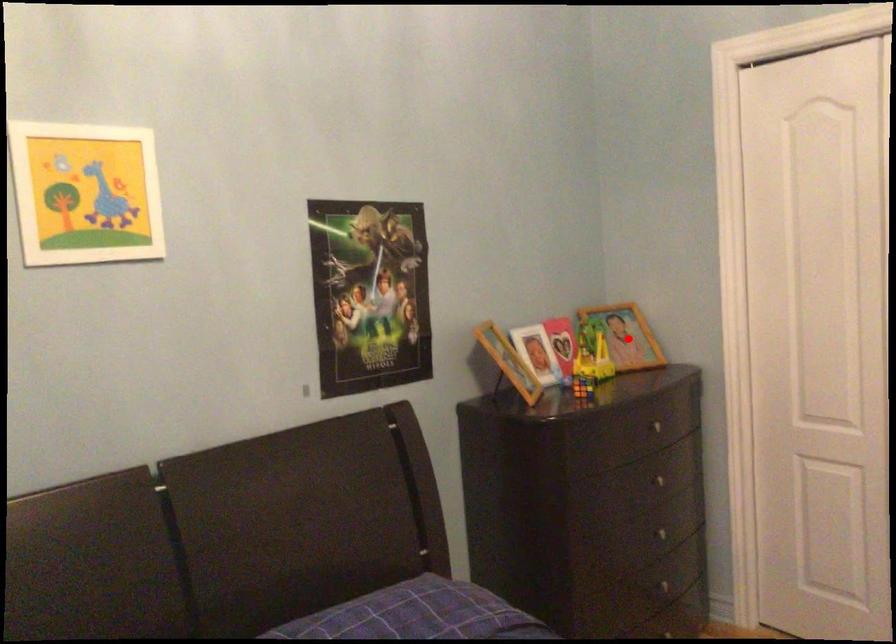
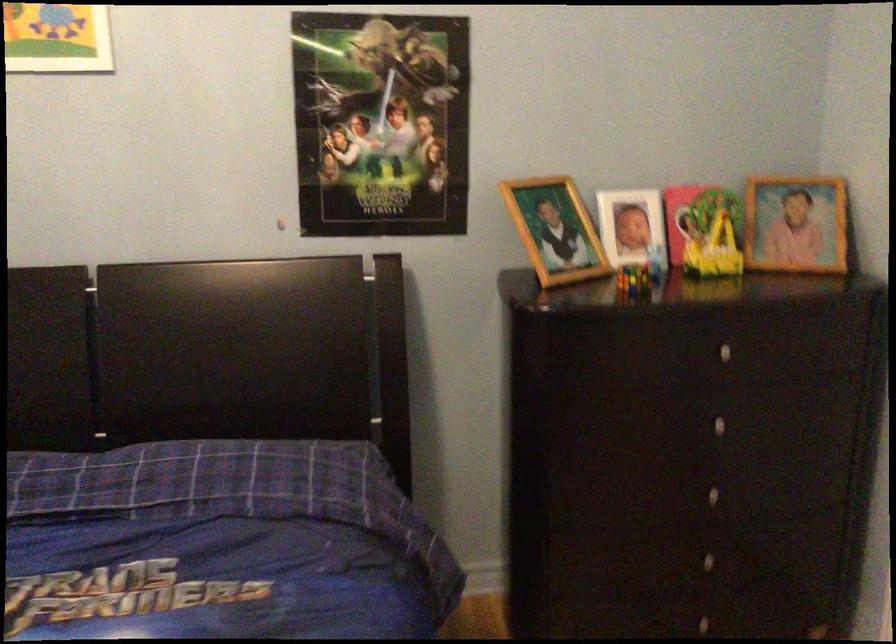
Question: I am providing you with two images of the same scene from different viewpoints. A red point is shown in image1. For the corresponding object point in image2, is it positioned nearer or farther from the camera?

Choices:
 (A) Nearer
 (B) Farther

Answer: (A)